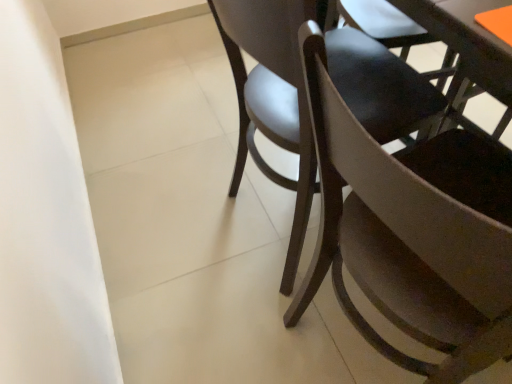
Question: Should I look upward or downward to see matte black chair at center, which is the second chair from bottom to top?

Choices:
 (A) down
 (B) up

Answer: (B)

Question: Is matte black chair at center, which is the second chair from bottom to top, smaller than matte brown chair at center, the 2th chair in the top-to-bottom sequence?

Choices:
 (A) yes
 (B) no

Answer: (B)

Question: Does matte black chair at center, arranged as the 1th chair when viewed from the top, have a lesser width compared to matte brown chair at center, the 2th chair in the top-to-bottom sequence?

Choices:
 (A) yes
 (B) no

Answer: (B)

Question: From the image's perspective, is matte black chair at center, arranged as the 1th chair when viewed from the top, below matte brown chair at center, which is the 1th chair from bottom to top?

Choices:
 (A) yes
 (B) no

Answer: (B)

Question: From a real-world perspective, is matte black chair at center, which is the second chair from bottom to top, positioned under matte brown chair at center, the 2th chair in the top-to-bottom sequence, based on gravity?

Choices:
 (A) no
 (B) yes

Answer: (B)

Question: Considering the relative sizes of matte black chair at center, arranged as the 1th chair when viewed from the top, and matte brown chair at center, which is the 1th chair from bottom to top, in the image provided, is matte black chair at center, arranged as the 1th chair when viewed from the top, taller than matte brown chair at center, which is the 1th chair from bottom to top,?

Choices:
 (A) yes
 (B) no

Answer: (B)

Question: Would you say matte black chair at center, which is the second chair from bottom to top, is outside matte brown chair at center, which is the 1th chair from bottom to top?

Choices:
 (A) yes
 (B) no

Answer: (A)

Question: Is matte brown chair at center, which is the 1th chair from bottom to top, turned away from matte black chair at center, arranged as the 1th chair when viewed from the top?

Choices:
 (A) yes
 (B) no

Answer: (B)

Question: Is matte black chair at center, arranged as the 1th chair when viewed from the top, surrounded by matte brown chair at center, the 2th chair in the top-to-bottom sequence?

Choices:
 (A) yes
 (B) no

Answer: (B)

Question: From a real-world perspective, is matte brown chair at center, the 2th chair in the top-to-bottom sequence, on top of matte black chair at center, arranged as the 1th chair when viewed from the top?

Choices:
 (A) no
 (B) yes

Answer: (B)

Question: Is matte brown chair at center, which is the 1th chair from bottom to top, facing towards matte black chair at center, arranged as the 1th chair when viewed from the top?

Choices:
 (A) no
 (B) yes

Answer: (A)

Question: Can you confirm if matte brown chair at center, the 2th chair in the top-to-bottom sequence, is smaller than matte black chair at center, arranged as the 1th chair when viewed from the top?

Choices:
 (A) yes
 (B) no

Answer: (A)

Question: Can you confirm if matte brown chair at center, which is the 1th chair from bottom to top, is bigger than matte black chair at center, arranged as the 1th chair when viewed from the top?

Choices:
 (A) no
 (B) yes

Answer: (A)

Question: In the image, is matte black chair at center, arranged as the 1th chair when viewed from the top, on the left side or the right side of matte brown chair at center, which is the 1th chair from bottom to top?

Choices:
 (A) right
 (B) left

Answer: (B)